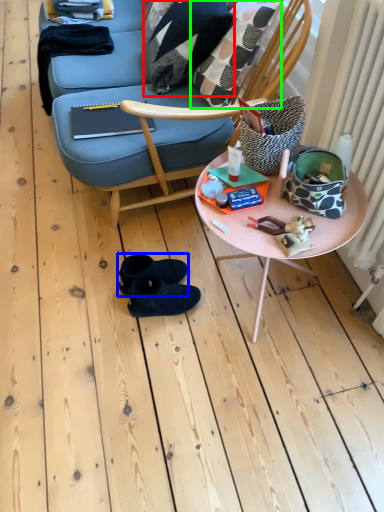
Question: Considering the real-world distances, which object is closest to pillow (highlighted by a red box)? footwear (highlighted by a blue box) or throw pillow (highlighted by a green box).

Choices:
 (A) footwear
 (B) throw pillow

Answer: (B)